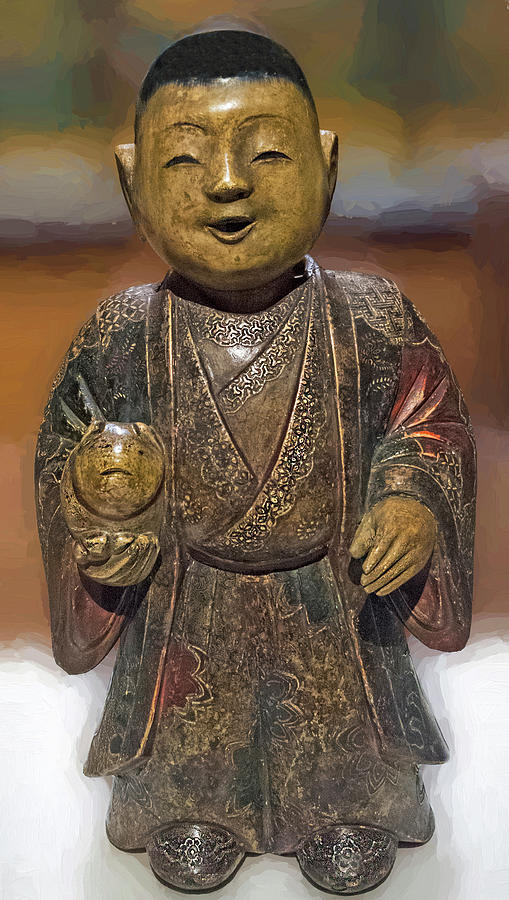
This screenshot has height=900, width=509. I want to click on robes, so click(x=265, y=696).